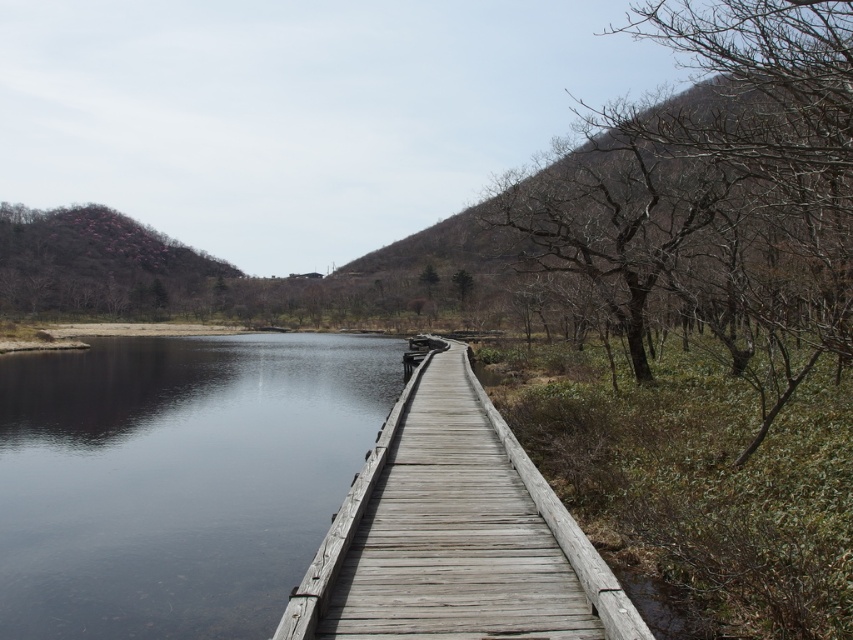
Is transparent water at center taller than weathered wood dock at center?

Correct, transparent water at center is much taller as weathered wood dock at center.

Is transparent water at center closer to the viewer compared to weathered wood dock at center?

No, transparent water at center is behind weathered wood dock at center.

Is point (229, 628) closer to camera compared to point (618, 604)?

No, (229, 628) is further to viewer.

At what (x,y) coordinates should I click in order to perform the action: click on transparent water at center. Please return your answer as a coordinate pair (x, y). This screenshot has height=640, width=853. Looking at the image, I should click on (177, 477).